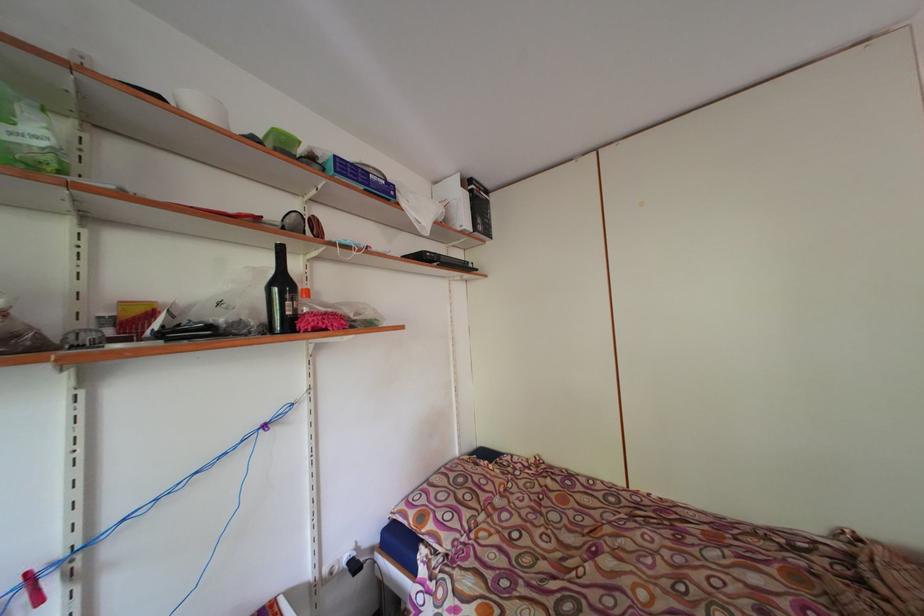
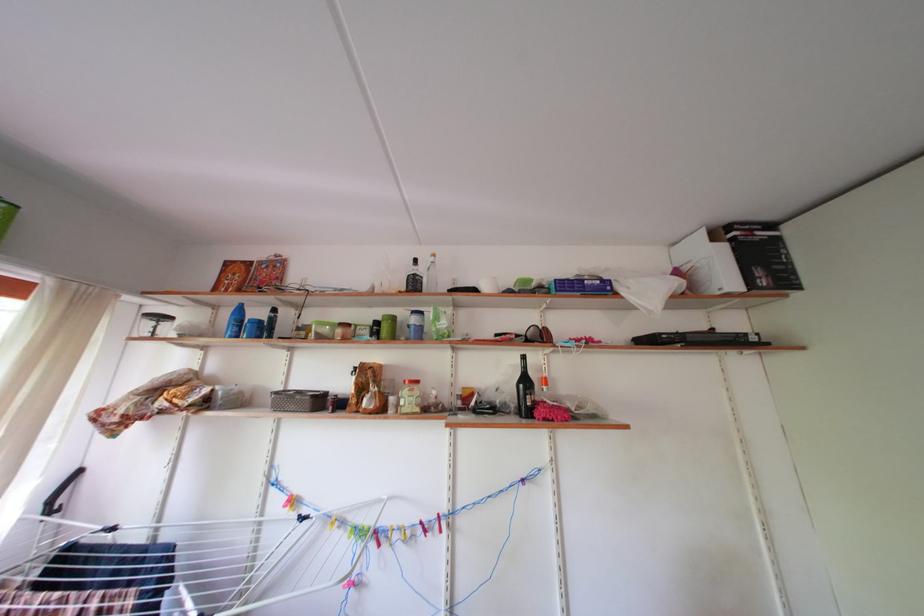
Find the pixel in the second image that matches [290,289] in the first image.

(533, 387)